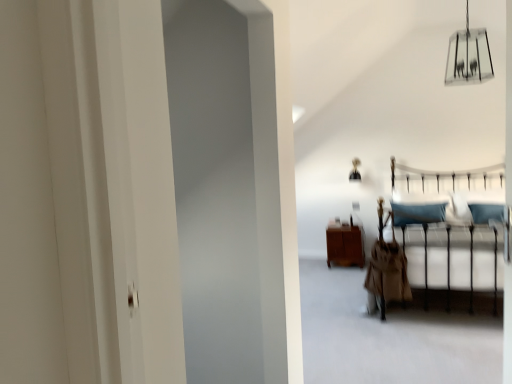
Question: Considering the relative positions of metallic gold lamp at upper center, the 2th lamp in the front-to-back sequence, and clear glass chandelier at upper center, the first lamp viewed from the front, in the image provided, is metallic gold lamp at upper center, the 2th lamp in the front-to-back sequence, in front of clear glass chandelier at upper center, the first lamp viewed from the front,?

Choices:
 (A) no
 (B) yes

Answer: (A)

Question: Is metallic gold lamp at upper center, which is the 1th lamp in back-to-front order, touching clear glass chandelier at upper center, the 2th lamp in the left-to-right sequence?

Choices:
 (A) yes
 (B) no

Answer: (B)

Question: From the image's perspective, is metallic gold lamp at upper center, the 2th lamp in the front-to-back sequence, on top of clear glass chandelier at upper center, arranged as the 1th lamp when viewed from the right?

Choices:
 (A) no
 (B) yes

Answer: (A)

Question: Is metallic gold lamp at upper center, which is the 2th lamp from right to left, wider than clear glass chandelier at upper center, the 1th lamp in the top-to-bottom sequence?

Choices:
 (A) no
 (B) yes

Answer: (A)

Question: Can you confirm if metallic gold lamp at upper center, positioned as the first lamp in left-to-right order, is taller than clear glass chandelier at upper center, the 1th lamp in the top-to-bottom sequence?

Choices:
 (A) no
 (B) yes

Answer: (A)

Question: Is metallic gold lamp at upper center, which appears as the second lamp when viewed from the top, behind clear glass chandelier at upper center, the 2th lamp viewed from the back?

Choices:
 (A) no
 (B) yes

Answer: (B)

Question: Is metallic gold lamp at upper center, which is the 1th lamp in back-to-front order, wider than brown wood cabinet at center?

Choices:
 (A) no
 (B) yes

Answer: (A)

Question: From a real-world perspective, is metallic gold lamp at upper center, positioned as the first lamp in left-to-right order, on top of brown wood cabinet at center?

Choices:
 (A) yes
 (B) no

Answer: (A)

Question: From the image's perspective, is metallic gold lamp at upper center, which appears as the second lamp when viewed from the top, on top of brown wood cabinet at center?

Choices:
 (A) no
 (B) yes

Answer: (B)

Question: Considering the relative sizes of metallic gold lamp at upper center, which is the 2th lamp from right to left, and brown wood cabinet at center in the image provided, is metallic gold lamp at upper center, which is the 2th lamp from right to left, smaller than brown wood cabinet at center?

Choices:
 (A) no
 (B) yes

Answer: (B)

Question: Is metallic gold lamp at upper center, the 2th lamp in the front-to-back sequence, not near brown wood cabinet at center?

Choices:
 (A) yes
 (B) no

Answer: (B)

Question: Does metallic gold lamp at upper center, the 2th lamp in the front-to-back sequence, come in front of brown wood cabinet at center?

Choices:
 (A) yes
 (B) no

Answer: (B)

Question: Can we say clear glass chandelier at upper center, arranged as the second lamp when ordered from the bottom, lies outside metallic gold lamp at upper center, positioned as the first lamp in left-to-right order?

Choices:
 (A) yes
 (B) no

Answer: (A)